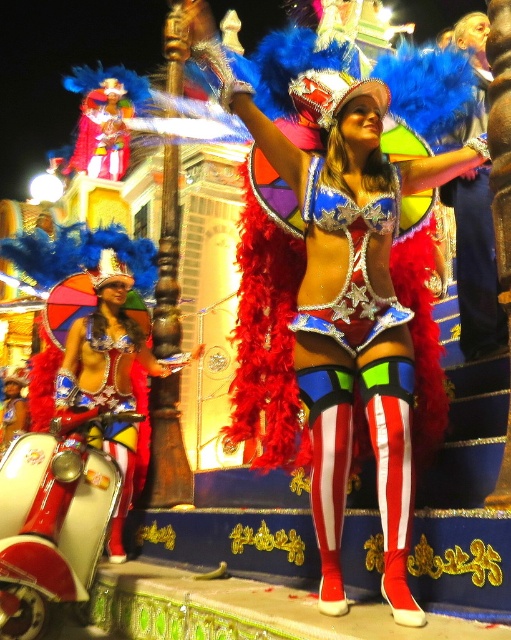
You are a photographer positioned at the back of the parade route. You want to capture a closeup shot of the shiny metallic costume at center. Given that your camera has a maximum zoom range of 30 meters, will you be able to take the photo?

The shiny metallic costume at center is 36.82 meters away from the viewer. Since the camera can only zoom up to 30 meters, it won cannot reach the required distance. Therefore, you won cannot take a closeup shot of the shiny metallic costume at center with the current camera settings.

You are a photographer at the carnival trying to capture a clear photo of the shiny metallic costume at center and the shiny metallic scooter at lower left. Since both are metallic, you want to ensure they are well lit. Which object should you focus on first to ensure it is properly illuminated?

The shiny metallic costume at center is in front of the shiny metallic scooter at lower left. Therefore, you should focus on the shiny metallic costume at center first to ensure it is properly illuminated before the scooter, as it is closer to the light source.

Based on the photo, you are a photographer at the carnival trying to capture a wide shot of the performers. You have a camera that can only focus on objects within a 1.2 meter width. Which scooter between the white glossy scooter at lower left and the shiny metallic scooter at lower left is more likely to be fully captured in your photo?

The white glossy scooter at lower left has a smaller width than the shiny metallic scooter at lower left. Since the camera can only focus on objects within a 1.2 meter width, the white glossy scooter at lower left is more likely to be fully captured in the photo.